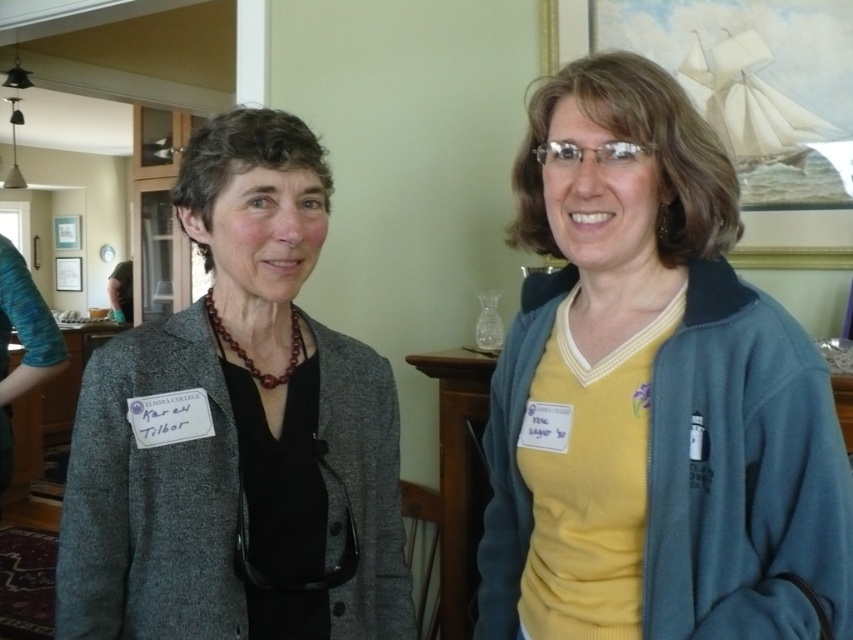
Can you confirm if yellow fleece jacket at right is taller than matte gray blazer at center?

Correct, yellow fleece jacket at right is much taller as matte gray blazer at center.

Which is above, yellow fleece jacket at right or matte gray blazer at center?

yellow fleece jacket at right is above.

Is point (553, 602) more distant than point (59, 582)?

That is True.

You are a GUI agent. You are given a task and a screenshot of the screen. Output one action in this format:
    pyautogui.click(x=<x>, y=<y>)
    Task: Click on the yellow fleece jacket at right
    
    Given the screenshot: What is the action you would take?
    pyautogui.click(x=653, y=394)